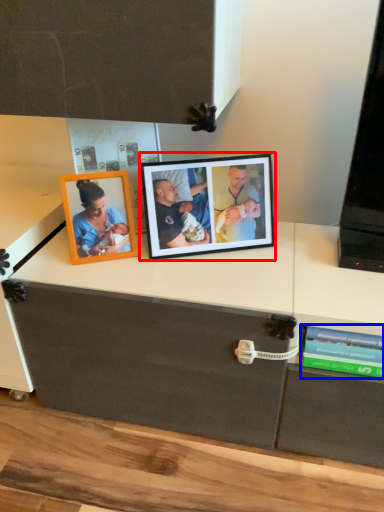
Question: Among these objects, which one is farthest to the camera, picture frame (highlighted by a red box) or book (highlighted by a blue box)?

Choices:
 (A) picture frame
 (B) book

Answer: (A)